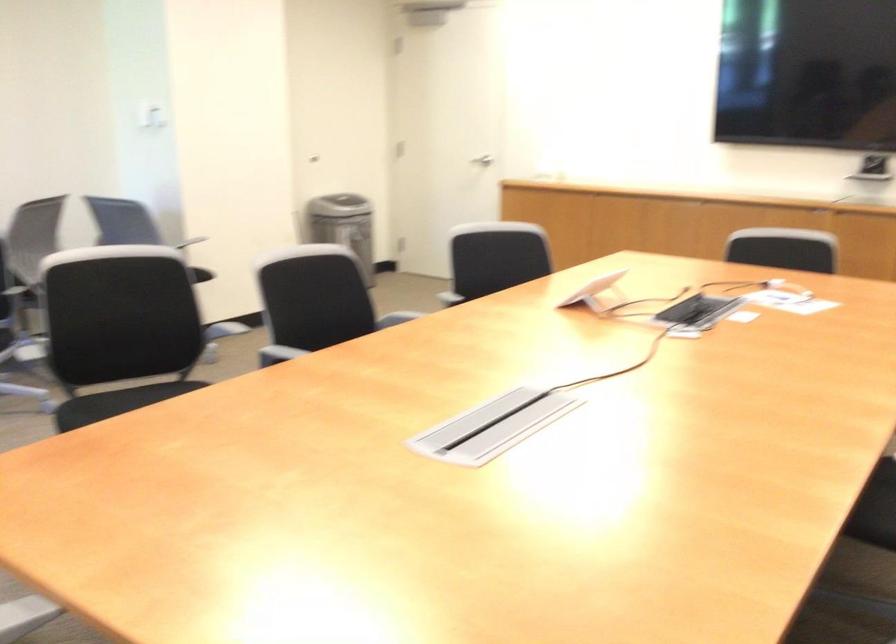
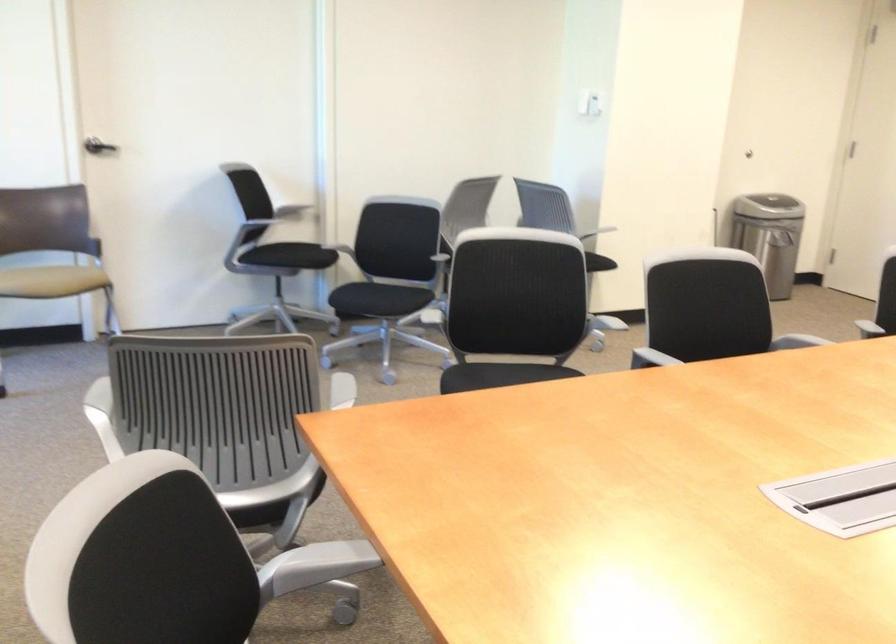
In the second image, find the point that corresponds to pixel 123 330 in the first image.

(513, 307)